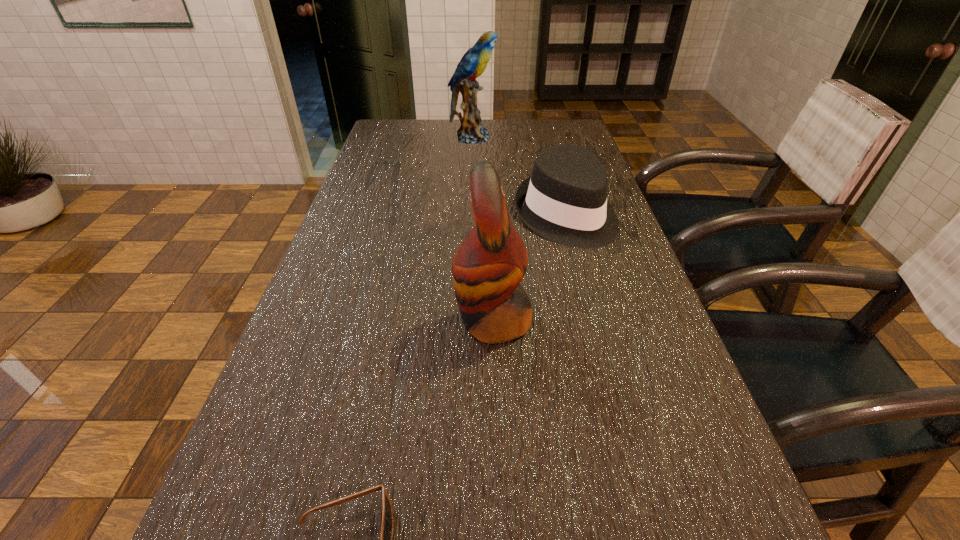
Image resolution: width=960 pixels, height=540 pixels. I want to click on the farther parrot, so click(x=473, y=63).

Image resolution: width=960 pixels, height=540 pixels. What are the coordinates of `the second nearest object` in the screenshot? It's located at (489, 264).

I want to click on fedora, so click(x=564, y=200).

Identify the location of the third tallest object. (564, 200).

Find the location of a particular element. free location located on the face of the farthest object is located at coordinates (542, 138).

Where is `vacant space situated 0.180m on the face of the nearer parrot`? This screenshot has height=540, width=960. vacant space situated 0.180m on the face of the nearer parrot is located at coordinates click(368, 321).

This screenshot has width=960, height=540. In order to click on vacant space situated on the face of the nearer parrot in this screenshot , I will do click(x=339, y=321).

Locate an element on the screen. blank area located 0.130m on the face of the nearer parrot is located at coordinates (392, 321).

Image resolution: width=960 pixels, height=540 pixels. What are the coordinates of `vacant space located 0.200m on the back of the second shortest object` in the screenshot? It's located at (550, 157).

Image resolution: width=960 pixels, height=540 pixels. Find the location of `object that is at the far edge`. object that is at the far edge is located at coordinates (473, 63).